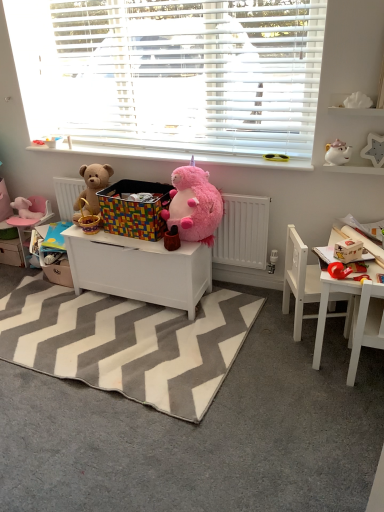
Find the location of a particular element. This screenshot has width=384, height=512. vacant space that is to the left of white glossy table at right, which is the 2th table in left-to-right order is located at coordinates (273, 357).